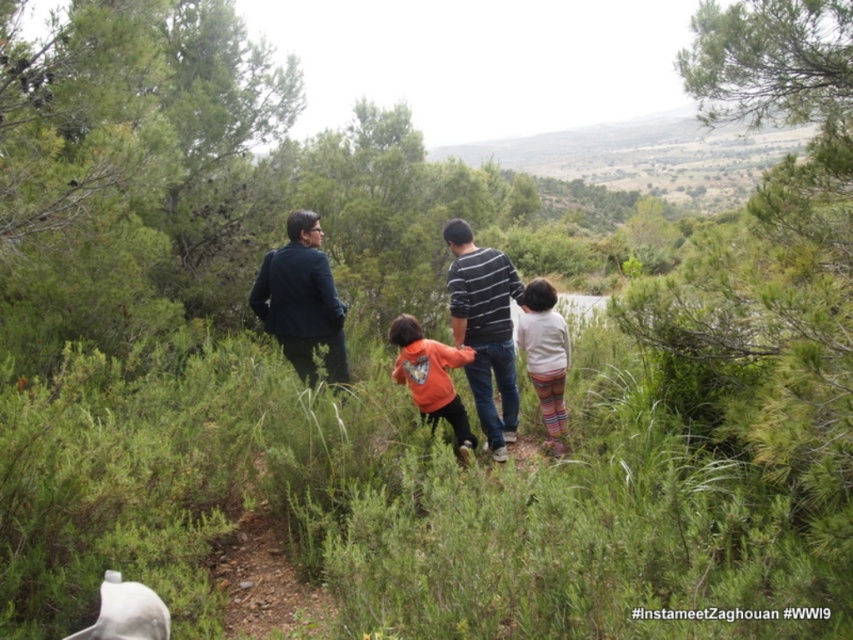
Can you confirm if striped cotton shirt at center is thinner than orange fleece jacket at center?

In fact, striped cotton shirt at center might be wider than orange fleece jacket at center.

Who is lower down, striped cotton shirt at center or orange fleece jacket at center?

orange fleece jacket at center is below.

The width and height of the screenshot is (853, 640). I want to click on striped cotton shirt at center, so click(x=485, y=328).

Between striped cotton shirt at center and white striped sweater at center, which one has more height?

Standing taller between the two is striped cotton shirt at center.

Can you confirm if striped cotton shirt at center is smaller than white striped sweater at center?

Incorrect, striped cotton shirt at center is not smaller in size than white striped sweater at center.

Measure the distance between point (485, 381) and camera.

The distance of point (485, 381) from camera is 19.61 feet.

Locate an element on the screen. This screenshot has width=853, height=640. striped cotton shirt at center is located at coordinates (485, 328).

Does orange fleece jacket at center have a lesser height compared to white striped sweater at center?

Correct, orange fleece jacket at center is not as tall as white striped sweater at center.

Is point (425, 381) closer to viewer compared to point (527, 337)?

That is True.

Does point (444, 380) come farther from viewer compared to point (544, 365)?

No, (444, 380) is closer to viewer.

Where is `orange fleece jacket at center`? orange fleece jacket at center is located at coordinates (431, 378).